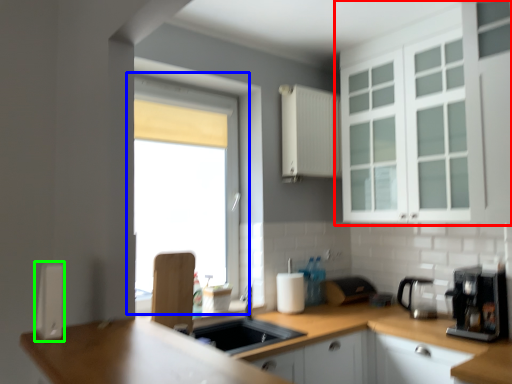
Question: Based on their relative distances, which object is nearer to cabinetry (highlighted by a red box)? Choose from window (highlighted by a blue box) and appliance (highlighted by a green box).

Choices:
 (A) window
 (B) appliance

Answer: (B)